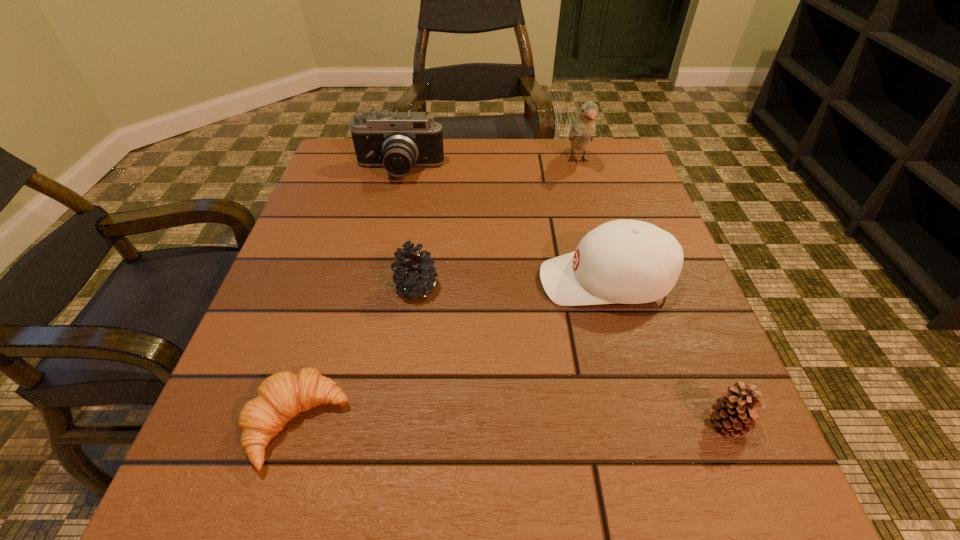
The image size is (960, 540). What are the coordinates of `vacant space at the right edge of the desktop` in the screenshot? It's located at (635, 361).

The width and height of the screenshot is (960, 540). In order to click on vacant region at the far left corner of the desktop in this screenshot , I will do `click(345, 190)`.

Image resolution: width=960 pixels, height=540 pixels. In the image, there is a desktop. Find the location of `vacant space at the near left corner`. vacant space at the near left corner is located at coordinates (270, 460).

Where is `free spot between the camera and the shortest object`? The width and height of the screenshot is (960, 540). free spot between the camera and the shortest object is located at coordinates (348, 298).

The width and height of the screenshot is (960, 540). I want to click on empty location between the bird and the crescent roll, so click(438, 293).

Image resolution: width=960 pixels, height=540 pixels. I want to click on vacant point located between the bird and the taller pinecone, so click(x=497, y=224).

Where is `vacant space in between the camera and the tallest object`? The image size is (960, 540). vacant space in between the camera and the tallest object is located at coordinates (489, 166).

This screenshot has height=540, width=960. In order to click on vacant space that is in between the bird and the baseball cap in this screenshot , I will do `click(591, 221)`.

At what (x,y) coordinates should I click in order to perform the action: click on vacant space that's between the left pinecone and the camera. Please return your answer as a coordinate pair (x, y). This screenshot has width=960, height=540. Looking at the image, I should click on (408, 230).

You are a GUI agent. You are given a task and a screenshot of the screen. Output one action in this format:
    pyautogui.click(x=<x>, y=<y>)
    Task: Click on the vacant region between the camera and the baseball cap
    This screenshot has height=540, width=960.
    Given the screenshot: What is the action you would take?
    pyautogui.click(x=502, y=226)